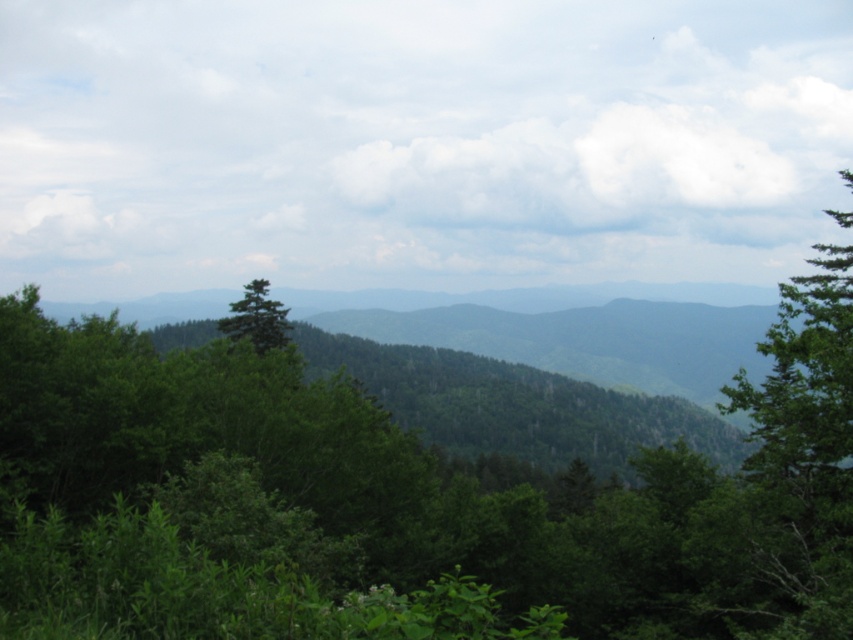
Between green leafy tree at right and green matte tree at center, which one appears on the right side from the viewer's perspective?

From the viewer's perspective, green leafy tree at right appears more on the right side.

Does green leafy tree at right come in front of green matte tree at center?

Yes.

Between point (845, 253) and point (273, 307), which one is positioned in front?

Point (845, 253) is in front.

Where is `green leafy tree at right`? The height and width of the screenshot is (640, 853). green leafy tree at right is located at coordinates (799, 460).